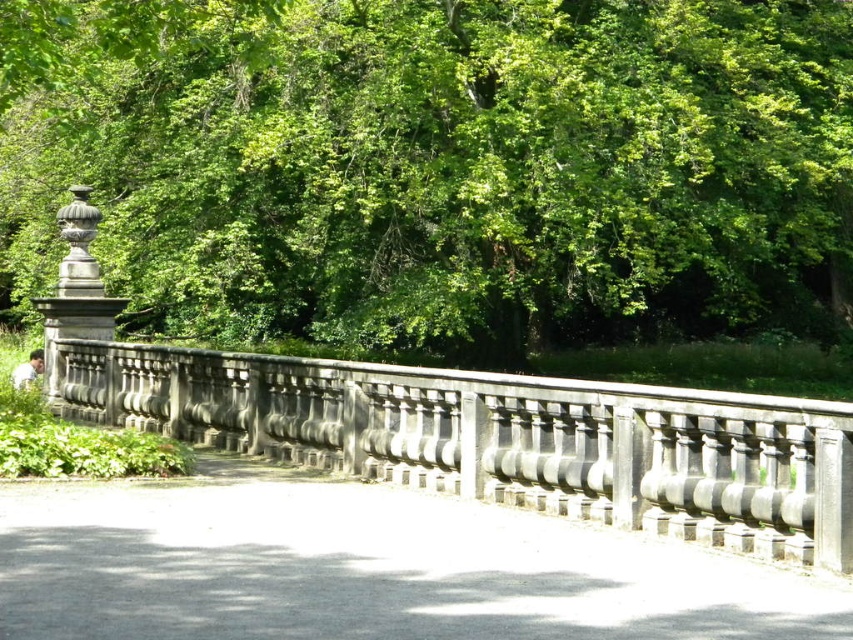
Question: Does green leafy tree at upper center have a lesser width compared to gray stone fence at center?

Choices:
 (A) no
 (B) yes

Answer: (A)

Question: Which object appears closest to the camera in this image?

Choices:
 (A) gray stone fence at center
 (B) gray concrete path at center
 (C) green leafy tree at upper center

Answer: (B)

Question: Which of the following is the farthest from the observer?

Choices:
 (A) green leafy tree at upper center
 (B) gray stone fence at center

Answer: (A)

Question: Does gray concrete path at center appear over gray stone fence at center?

Choices:
 (A) yes
 (B) no

Answer: (B)

Question: Does gray concrete path at center appear under gray stone fence at center?

Choices:
 (A) yes
 (B) no

Answer: (A)

Question: Which object is positioned farthest from the green leafy tree at upper center?

Choices:
 (A) gray stone fence at center
 (B) gray concrete path at center

Answer: (B)